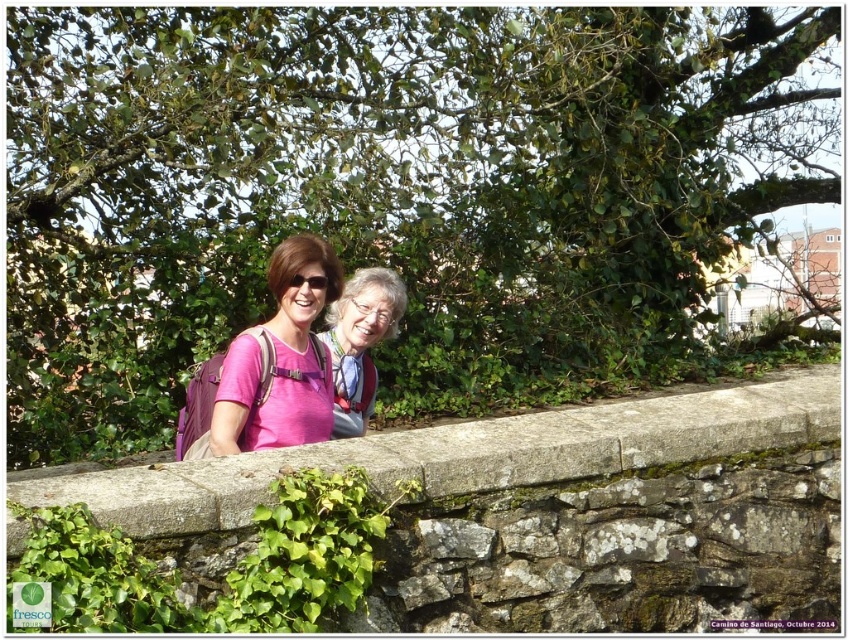
Question: Among these objects, which one is nearest to the camera?

Choices:
 (A) gray stone ledge at center
 (B) pink fabric shirt at center

Answer: (A)

Question: Does green leafy tree at upper center appear on the left side of gray stone ledge at center?

Choices:
 (A) no
 (B) yes

Answer: (B)

Question: Can you confirm if green leafy tree at upper center is positioned above pink fabric at center?

Choices:
 (A) yes
 (B) no

Answer: (A)

Question: Does gray stone ledge at center appear on the left side of pink fabric at center?

Choices:
 (A) no
 (B) yes

Answer: (A)

Question: Which is nearer to the pink fabric shirt at center?

Choices:
 (A) green leafy tree at upper center
 (B) gray stone ledge at center
 (C) pink fabric at center

Answer: (C)

Question: Which object appears closest to the camera in this image?

Choices:
 (A) pink fabric shirt at center
 (B) gray stone ledge at center
 (C) green leafy tree at upper center

Answer: (B)